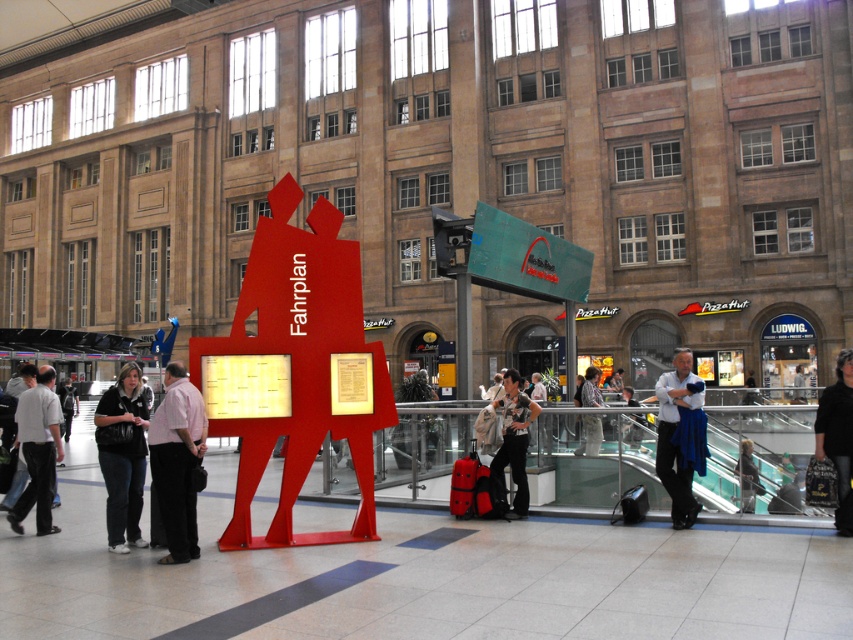
Question: Which point appears closest to the camera in this image?

Choices:
 (A) (39, 372)
 (B) (677, 410)
 (C) (625, 440)

Answer: (B)

Question: Does pink shirt at center have a larger size compared to golden hair at upper right?

Choices:
 (A) yes
 (B) no

Answer: (A)

Question: Can you confirm if black leather pants at center is thinner than black leather jacket at center?

Choices:
 (A) yes
 (B) no

Answer: (A)

Question: Which object is the closest to the dark brown leather jacket at lower right?

Choices:
 (A) black leather pants at center
 (B) black leather jacket at lower left

Answer: (A)

Question: Which object is positioned farthest from the white shirt at center?

Choices:
 (A) striped shirt at center
 (B) pink shirt at center
 (C) dark gray pants at left
 (D) black leather jacket at center

Answer: (D)

Question: Is black leather jacket at lower left thinner than dark blue jeans at center?

Choices:
 (A) no
 (B) yes

Answer: (B)